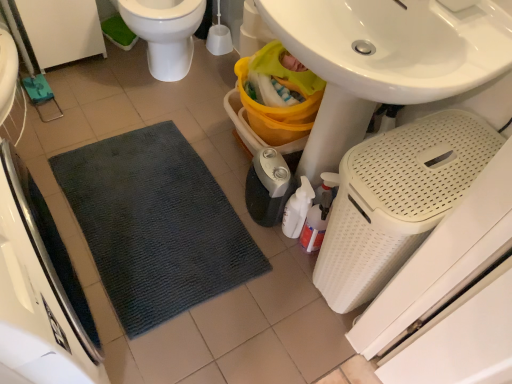
Question: Can you confirm if translucent plastic spray bottle at lower center is shorter than white perforated laundry basket at lower right, arranged as the 1th appliance when viewed from the right?

Choices:
 (A) no
 (B) yes

Answer: (B)

Question: Considering the relative sizes of translucent plastic spray bottle at lower center and white perforated laundry basket at lower right, the 3th appliance when ordered from left to right, in the image provided, is translucent plastic spray bottle at lower center taller than white perforated laundry basket at lower right, the 3th appliance when ordered from left to right,?

Choices:
 (A) no
 (B) yes

Answer: (A)

Question: From a real-world perspective, is translucent plastic spray bottle at lower center positioned under white perforated laundry basket at lower right, the 3th appliance when ordered from left to right, based on gravity?

Choices:
 (A) no
 (B) yes

Answer: (B)

Question: Is white perforated laundry basket at lower right, arranged as the 1th appliance when viewed from the right, a part of translucent plastic spray bottle at lower center?

Choices:
 (A) yes
 (B) no

Answer: (B)

Question: Can you confirm if translucent plastic spray bottle at lower center is bigger than white perforated laundry basket at lower right, arranged as the 1th appliance when viewed from the right?

Choices:
 (A) no
 (B) yes

Answer: (A)

Question: Is translucent plastic spray bottle at lower center oriented towards white perforated laundry basket at lower right, arranged as the 1th appliance when viewed from the right?

Choices:
 (A) no
 (B) yes

Answer: (B)

Question: Is white glossy toilet at upper left turned away from black plastic humidifier at lower center, the second appliance when ordered from left to right?

Choices:
 (A) yes
 (B) no

Answer: (B)

Question: Does white glossy toilet at upper left have a lesser width compared to black plastic humidifier at lower center, the second appliance when ordered from left to right?

Choices:
 (A) yes
 (B) no

Answer: (B)

Question: From a real-world perspective, is white glossy toilet at upper left located higher than black plastic humidifier at lower center, the 2th appliance from the right?

Choices:
 (A) no
 (B) yes

Answer: (B)

Question: Is white glossy toilet at upper left not inside black plastic humidifier at lower center, the 2th appliance from the right?

Choices:
 (A) no
 (B) yes

Answer: (B)

Question: Is white glossy toilet at upper left next to black plastic humidifier at lower center, the second appliance when ordered from left to right, and touching it?

Choices:
 (A) no
 (B) yes

Answer: (A)

Question: From the image's perspective, would you say white glossy toilet at upper left is positioned over black plastic humidifier at lower center, the 2th appliance from the right?

Choices:
 (A) no
 (B) yes

Answer: (B)

Question: Is the position of white perforated laundry basket at lower right, arranged as the 1th appliance when viewed from the right, less distant than that of black plastic humidifier at lower center, the 2th appliance from the right?

Choices:
 (A) yes
 (B) no

Answer: (A)